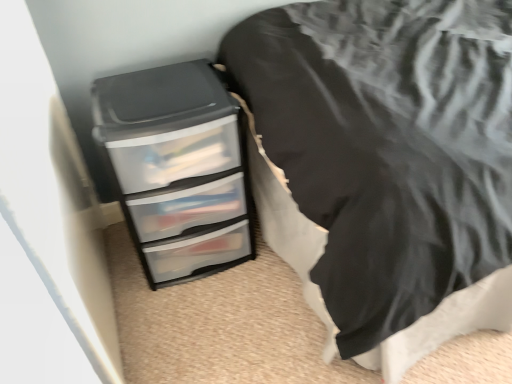
Question: Is clear plastic chest of drawers at lower left in front of or behind clear plastic drawers at lower left in the image?

Choices:
 (A) front
 (B) behind

Answer: (B)

Question: From the image's perspective, relative to clear plastic drawers at lower left, is clear plastic chest of drawers at lower left above or below?

Choices:
 (A) above
 (B) below

Answer: (B)

Question: In terms of width, does clear plastic chest of drawers at lower left look wider or thinner when compared to clear plastic drawers at lower left?

Choices:
 (A) wide
 (B) thin

Answer: (B)

Question: Based on their sizes in the image, would you say clear plastic drawers at lower left is bigger or smaller than clear plastic chest of drawers at lower left?

Choices:
 (A) big
 (B) small

Answer: (A)

Question: Considering the positions of clear plastic drawers at lower left and clear plastic chest of drawers at lower left in the image, is clear plastic drawers at lower left wider or thinner than clear plastic chest of drawers at lower left?

Choices:
 (A) wide
 (B) thin

Answer: (A)

Question: In terms of height, does clear plastic drawers at lower left look taller or shorter compared to clear plastic chest of drawers at lower left?

Choices:
 (A) tall
 (B) short

Answer: (A)

Question: Would you say clear plastic drawers at lower left is to the left or to the right of clear plastic chest of drawers at lower left in the picture?

Choices:
 (A) right
 (B) left

Answer: (A)